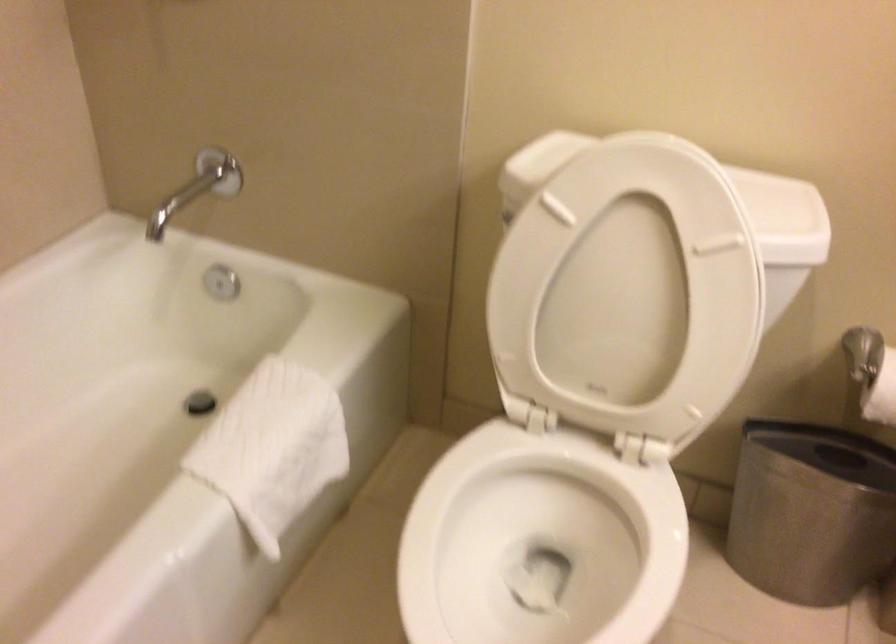
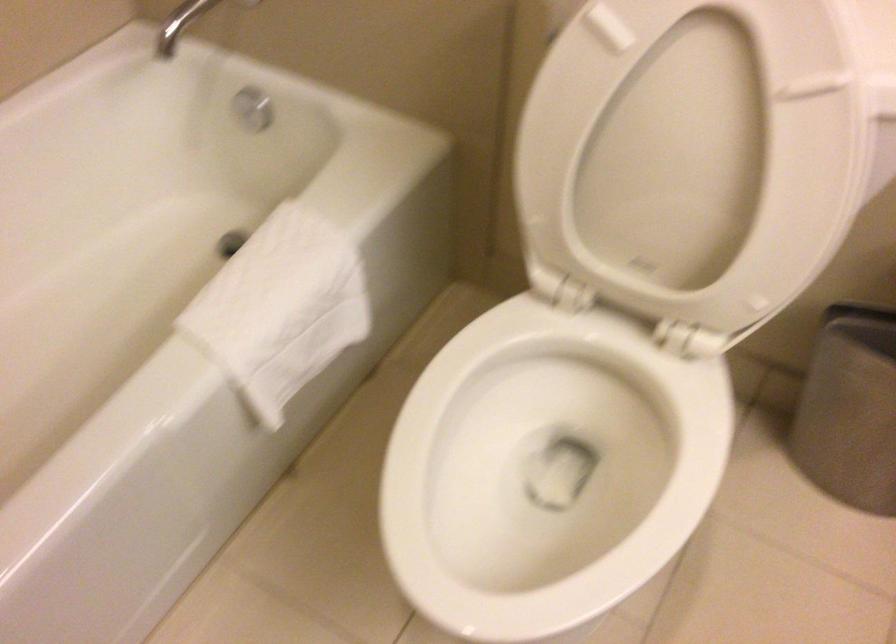
Find the pixel in the second image that matches (629,297) in the first image.

(691, 154)